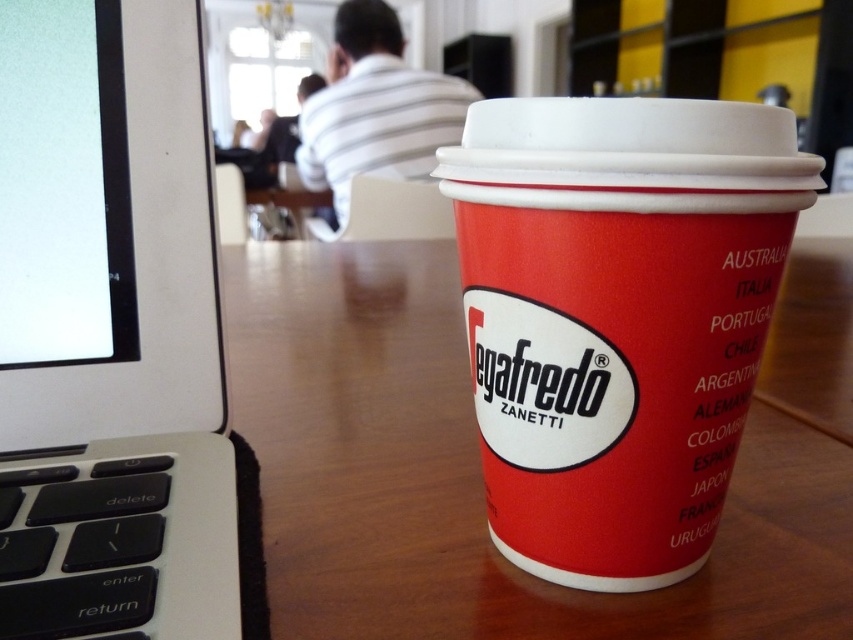
Question: Estimate the real-world distances between objects in this image. Which object is closer to the wooden table at center?

Choices:
 (A) white plastic laptop at left
 (B) red matte segafredo cup at center

Answer: (B)

Question: Which point is farther to the camera?

Choices:
 (A) wooden table at center
 (B) white plastic laptop at left

Answer: (A)

Question: Which object appears farthest from the camera in this image?

Choices:
 (A) red matte segafredo cup at center
 (B) white plastic laptop at left

Answer: (A)

Question: Can you confirm if wooden table at center is positioned above white plastic laptop at left?

Choices:
 (A) yes
 (B) no

Answer: (A)

Question: Can you confirm if wooden table at center is positioned above red matte segafredo cup at center?

Choices:
 (A) yes
 (B) no

Answer: (A)

Question: Is wooden table at center above white plastic laptop at left?

Choices:
 (A) yes
 (B) no

Answer: (A)